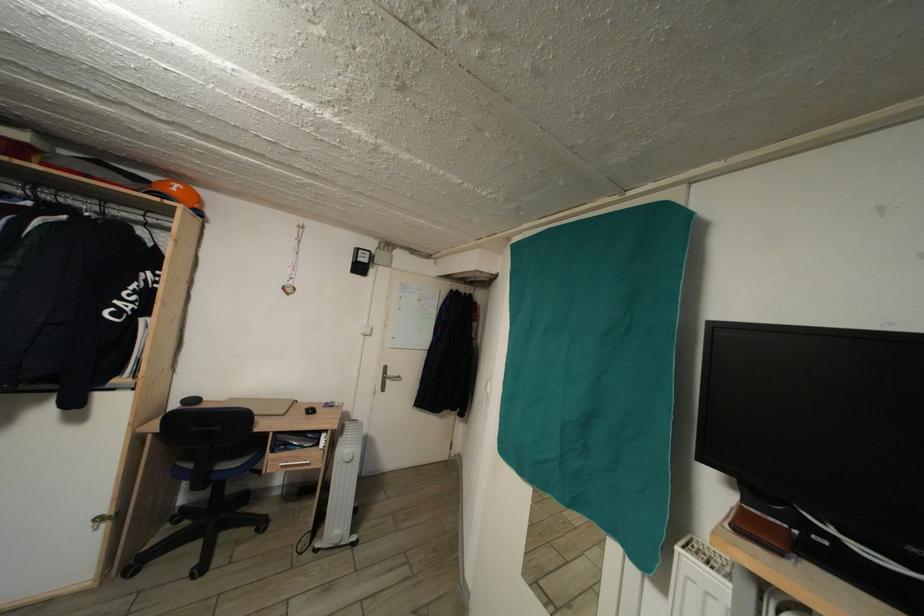
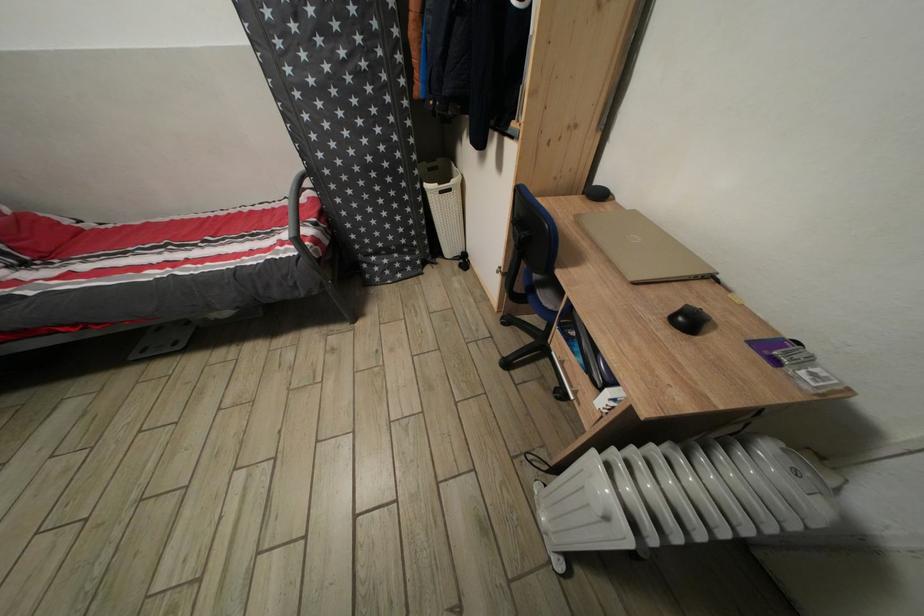
In the second image, find the point that corresponds to pixel 319 418 in the first image.

(696, 328)